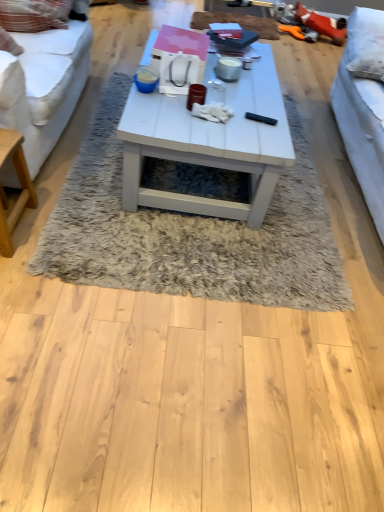
Question: Does white shaggy rug at center have a lesser height compared to white fabric couch at right, positioned as the first studio couch in right-to-left order?

Choices:
 (A) yes
 (B) no

Answer: (A)

Question: Can you confirm if white shaggy rug at center is wider than white fabric couch at right, positioned as the second studio couch in left-to-right order?

Choices:
 (A) no
 (B) yes

Answer: (B)

Question: Is white shaggy rug at center oriented towards white fabric couch at right, positioned as the first studio couch in right-to-left order?

Choices:
 (A) no
 (B) yes

Answer: (A)

Question: From a real-world perspective, is white shaggy rug at center over white fabric couch at right, positioned as the first studio couch in right-to-left order?

Choices:
 (A) no
 (B) yes

Answer: (A)

Question: Does white shaggy rug at center have a larger size compared to white fabric couch at right, positioned as the second studio couch in left-to-right order?

Choices:
 (A) no
 (B) yes

Answer: (A)

Question: Does white shaggy rug at center have a greater height compared to white fabric couch at right, positioned as the first studio couch in right-to-left order?

Choices:
 (A) no
 (B) yes

Answer: (A)

Question: Can you confirm if white matte coffee table at center is wider than white fabric couch at right, positioned as the first studio couch in right-to-left order?

Choices:
 (A) yes
 (B) no

Answer: (A)

Question: Are white matte coffee table at center and white fabric couch at right, positioned as the first studio couch in right-to-left order, far apart?

Choices:
 (A) yes
 (B) no

Answer: (B)

Question: Does white matte coffee table at center have a larger size compared to white fabric couch at right, positioned as the first studio couch in right-to-left order?

Choices:
 (A) no
 (B) yes

Answer: (A)

Question: Does white matte coffee table at center have a greater height compared to white fabric couch at right, positioned as the second studio couch in left-to-right order?

Choices:
 (A) yes
 (B) no

Answer: (B)

Question: Can white fabric couch at right, positioned as the first studio couch in right-to-left order, be found inside white matte coffee table at center?

Choices:
 (A) yes
 (B) no

Answer: (B)

Question: Is white matte coffee table at center at the right side of white fabric couch at right, positioned as the second studio couch in left-to-right order?

Choices:
 (A) yes
 (B) no

Answer: (B)

Question: From the image's perspective, does white fabric studio couch at left, arranged as the 2th studio couch when viewed from the right, appear higher than white shaggy rug at center?

Choices:
 (A) yes
 (B) no

Answer: (A)